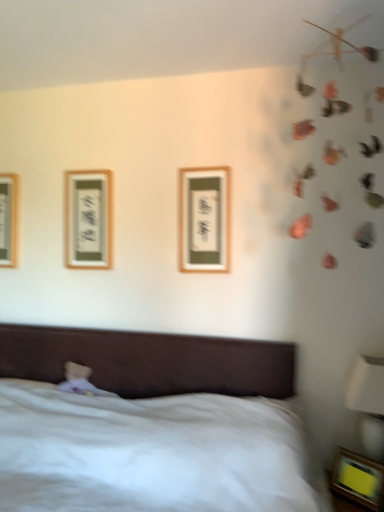
Question: Is the position of matte wood picture frame at upper left, placed as the third picture frame when sorted from bottom to top, less distant than that of wooden framed picture at left, which is the first picture frame in back-to-front order?

Choices:
 (A) yes
 (B) no

Answer: (A)

Question: From the image's perspective, is matte wood picture frame at upper left, which appears as the 3th picture frame when viewed from the front, on top of wooden framed picture at left, which is the first picture frame in back-to-front order?

Choices:
 (A) no
 (B) yes

Answer: (A)

Question: Is the depth of matte wood picture frame at upper left, the second picture frame from the top, greater than that of wooden framed picture at left, which is the first picture frame in back-to-front order?

Choices:
 (A) yes
 (B) no

Answer: (B)

Question: Is matte wood picture frame at upper left, placed as the third picture frame when sorted from bottom to top, oriented away from wooden framed picture at left, the 4th picture frame positioned from the right?

Choices:
 (A) yes
 (B) no

Answer: (B)

Question: Does matte wood picture frame at upper left, placed as the third picture frame when sorted from bottom to top, have a greater width compared to wooden framed picture at left, the 4th picture frame positioned from the right?

Choices:
 (A) no
 (B) yes

Answer: (A)

Question: Considering the relative sizes of matte wood picture frame at upper left, placed as the third picture frame when sorted from bottom to top, and wooden framed picture at left, which appears as the 1th picture frame when viewed from the left, in the image provided, is matte wood picture frame at upper left, placed as the third picture frame when sorted from bottom to top, smaller than wooden framed picture at left, which appears as the 1th picture frame when viewed from the left,?

Choices:
 (A) no
 (B) yes

Answer: (A)

Question: Is wooden framed picture at center, positioned as the 3th picture frame in left-to-right order, positioned before white glossy bedside lamp at lower right?

Choices:
 (A) yes
 (B) no

Answer: (B)

Question: From the image's perspective, is wooden framed picture at center, the 3th picture frame in the back-to-front sequence, under white glossy bedside lamp at lower right?

Choices:
 (A) yes
 (B) no

Answer: (B)

Question: Is white glossy bedside lamp at lower right at the back of wooden framed picture at center, which is the second picture frame in right-to-left order?

Choices:
 (A) yes
 (B) no

Answer: (B)

Question: Is wooden framed picture at center, which appears as the second picture frame when ordered from the bottom, to the left of white glossy bedside lamp at lower right from the viewer's perspective?

Choices:
 (A) no
 (B) yes

Answer: (B)

Question: Can you confirm if wooden framed picture at center, the 3th picture frame in the back-to-front sequence, is taller than white glossy bedside lamp at lower right?

Choices:
 (A) yes
 (B) no

Answer: (B)

Question: From a real-world perspective, is wooden framed picture at center, the third picture frame positioned from the top, located beneath white glossy bedside lamp at lower right?

Choices:
 (A) yes
 (B) no

Answer: (B)

Question: From a real-world perspective, does wooden framed picture at left, the 4th picture frame in the front-to-back sequence, sit lower than wooden framed picture at center, which appears as the second picture frame when ordered from the bottom?

Choices:
 (A) no
 (B) yes

Answer: (A)